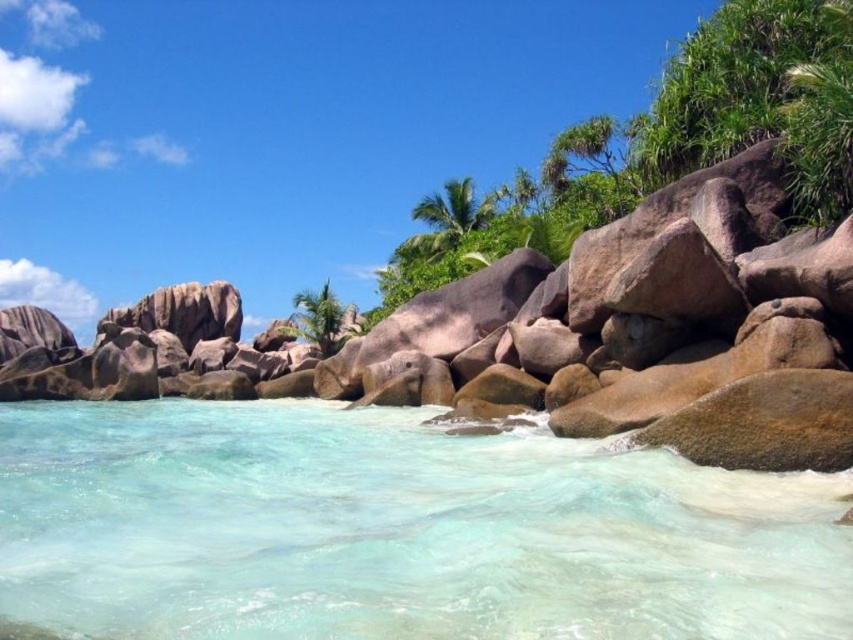
Question: Based on their relative distances, which object is farther from the green leafy palm tree at upper center?

Choices:
 (A) clear water at lower center
 (B) green leafy palm tree at center

Answer: (A)

Question: Is green leafy palm tree at upper center wider than green leafy palm tree at center?

Choices:
 (A) yes
 (B) no

Answer: (B)

Question: Which point appears farthest from the camera in this image?

Choices:
 (A) (329, 348)
 (B) (177, 556)
 (C) (457, 189)

Answer: (C)

Question: Is clear water at lower center above green leafy palm tree at center?

Choices:
 (A) yes
 (B) no

Answer: (B)

Question: Based on their relative distances, which object is farther from the green leafy palm tree at upper center?

Choices:
 (A) clear water at lower center
 (B) green leafy palm tree at center

Answer: (A)

Question: Is green leafy palm tree at upper center wider than green leafy palm tree at center?

Choices:
 (A) yes
 (B) no

Answer: (B)